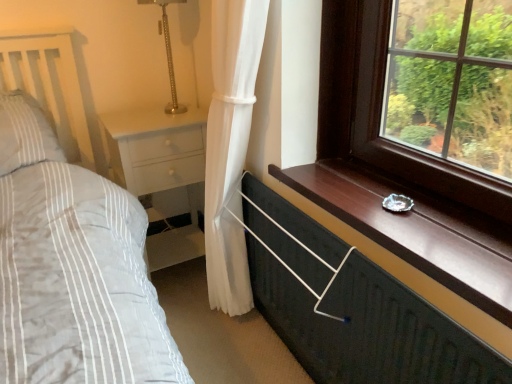
Question: Does white glossy nightstand at lower left appear on the right side of metallic dark green chest of drawers at lower right?

Choices:
 (A) yes
 (B) no

Answer: (B)

Question: Would you say white glossy nightstand at lower left contains metallic dark green chest of drawers at lower right?

Choices:
 (A) no
 (B) yes

Answer: (A)

Question: Can you confirm if white glossy nightstand at lower left is bigger than metallic dark green chest of drawers at lower right?

Choices:
 (A) no
 (B) yes

Answer: (B)

Question: From the image's perspective, is white glossy nightstand at lower left under metallic dark green chest of drawers at lower right?

Choices:
 (A) no
 (B) yes

Answer: (A)

Question: Can you confirm if white glossy nightstand at lower left is positioned to the left of metallic dark green chest of drawers at lower right?

Choices:
 (A) yes
 (B) no

Answer: (A)

Question: From a real-world perspective, is white glossy nightstand at lower left positioned above or below metallic dark green chest of drawers at lower right?

Choices:
 (A) below
 (B) above

Answer: (B)

Question: Visually, is white glossy nightstand at lower left positioned to the left or to the right of metallic dark green chest of drawers at lower right?

Choices:
 (A) right
 (B) left

Answer: (B)

Question: Considering the positions of white glossy nightstand at lower left and metallic dark green chest of drawers at lower right in the image, is white glossy nightstand at lower left wider or thinner than metallic dark green chest of drawers at lower right?

Choices:
 (A) wide
 (B) thin

Answer: (A)

Question: Which is correct: white glossy nightstand at lower left is inside metallic dark green chest of drawers at lower right, or outside of it?

Choices:
 (A) outside
 (B) inside

Answer: (A)

Question: Considering the positions of metallic dark green chest of drawers at lower right and white glossy nightstand at lower left in the image, is metallic dark green chest of drawers at lower right wider or thinner than white glossy nightstand at lower left?

Choices:
 (A) thin
 (B) wide

Answer: (A)

Question: From the image's perspective, is metallic dark green chest of drawers at lower right located above or below white glossy nightstand at lower left?

Choices:
 (A) above
 (B) below

Answer: (B)

Question: Is metallic dark green chest of drawers at lower right bigger or smaller than white glossy nightstand at lower left?

Choices:
 (A) small
 (B) big

Answer: (A)

Question: Is metallic dark green chest of drawers at lower right to the left or to the right of white glossy nightstand at lower left in the image?

Choices:
 (A) left
 (B) right

Answer: (B)

Question: Is metallic dark green chest of drawers at lower right taller or shorter than gold textured table lamp at upper center?

Choices:
 (A) tall
 (B) short

Answer: (A)

Question: Considering the positions of point (298, 210) and point (166, 26), is point (298, 210) closer or farther from the camera than point (166, 26)?

Choices:
 (A) farther
 (B) closer

Answer: (B)